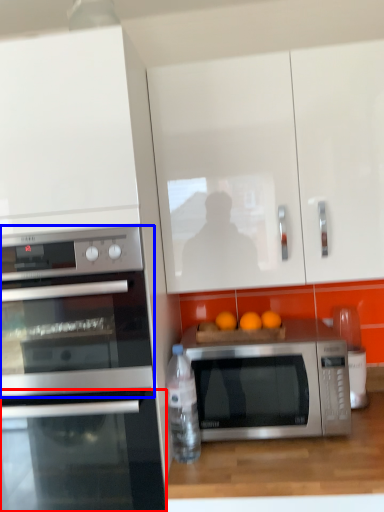
Question: Which point is further to the camera, oven (highlighted by a red box) or microwave oven (highlighted by a blue box)?

Choices:
 (A) oven
 (B) microwave oven

Answer: (A)